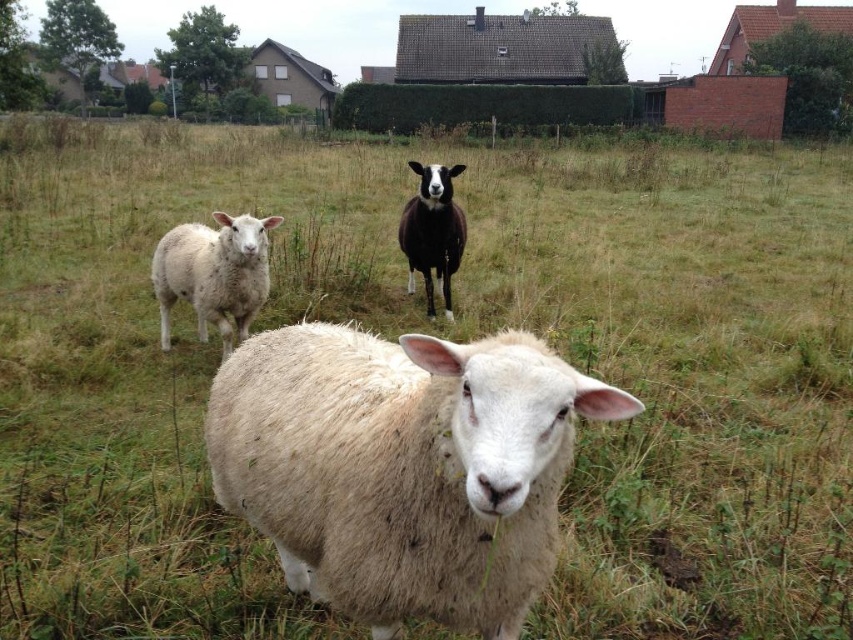
Can you confirm if white woolen sheep at left is positioned to the left of black woolen sheep at center?

Correct, you'll find white woolen sheep at left to the left of black woolen sheep at center.

Between white woolen sheep at left and black woolen sheep at center, which one has less height?

With less height is white woolen sheep at left.

You are a GUI agent. You are given a task and a screenshot of the screen. Output one action in this format:
    pyautogui.click(x=<x>, y=<y>)
    Task: Click on the white woolen sheep at left
    This screenshot has width=853, height=640.
    Given the screenshot: What is the action you would take?
    pyautogui.click(x=213, y=273)

Locate an element on the screen. This screenshot has width=853, height=640. white woolen sheep at left is located at coordinates [x=213, y=273].

The height and width of the screenshot is (640, 853). Find the location of `fuzzy white sheep at center`. fuzzy white sheep at center is located at coordinates (402, 467).

Find the location of a particular element. This screenshot has width=853, height=640. fuzzy white sheep at center is located at coordinates (402, 467).

The image size is (853, 640). Identify the location of fuzzy white sheep at center. (402, 467).

Does fuzzy white sheep at center have a lesser height compared to white woolen sheep at left?

Indeed, fuzzy white sheep at center has a lesser height compared to white woolen sheep at left.

This screenshot has height=640, width=853. What do you see at coordinates (402, 467) in the screenshot?
I see `fuzzy white sheep at center` at bounding box center [402, 467].

Image resolution: width=853 pixels, height=640 pixels. Identify the location of fuzzy white sheep at center. (402, 467).